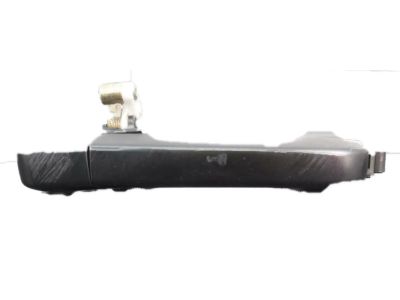
Locate an element on the screen. This screenshot has height=300, width=400. hinge is located at coordinates (116, 106).